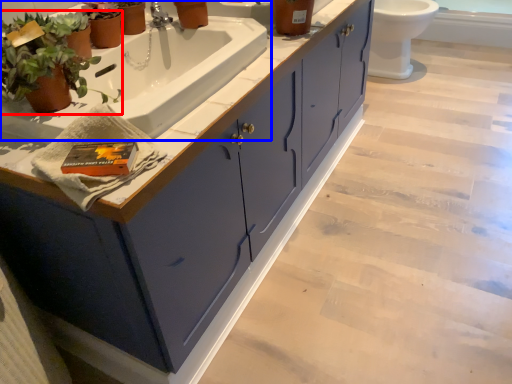
Question: Among these objects, which one is farthest to the camera, houseplant (highlighted by a red box) or sink (highlighted by a blue box)?

Choices:
 (A) houseplant
 (B) sink

Answer: (B)